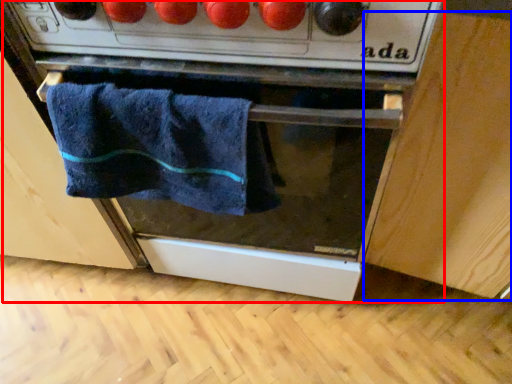
Question: Which point is further to the camera, oven (highlighted by a red box) or cabinetry (highlighted by a blue box)?

Choices:
 (A) oven
 (B) cabinetry

Answer: (A)